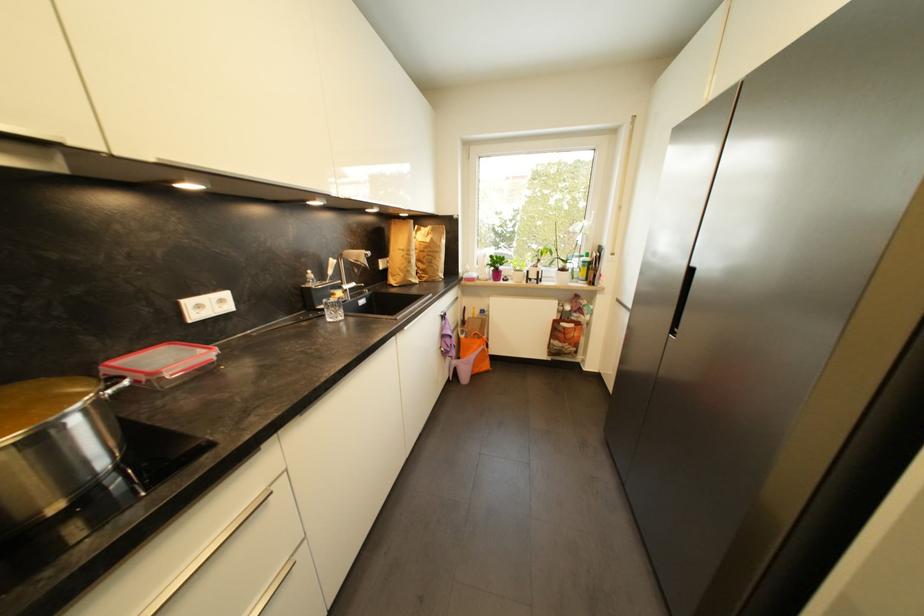
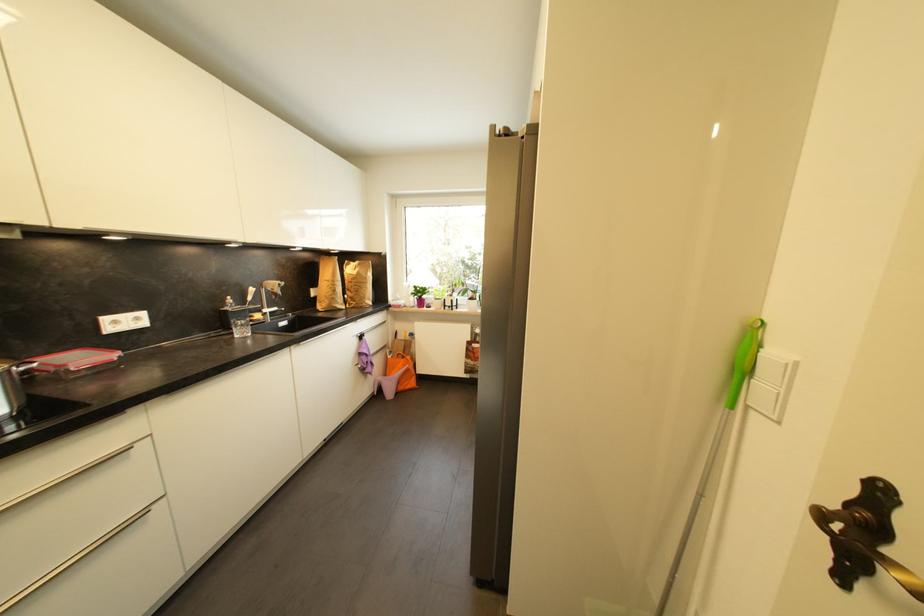
In the second image, find the point that corresponds to pixel 430 249 in the first image.

(358, 281)